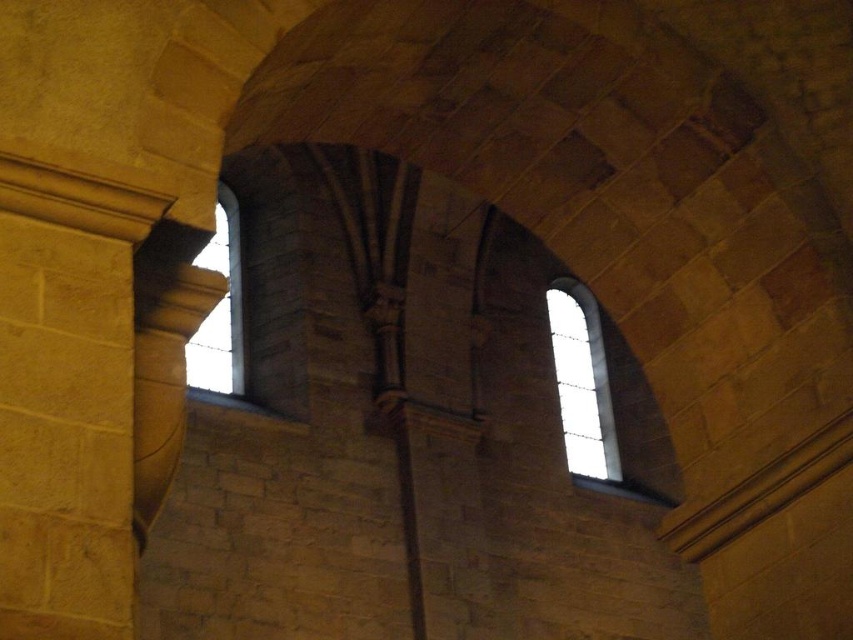
Question: Is clear glass window at upper right bigger than clear glass window at upper left?

Choices:
 (A) yes
 (B) no

Answer: (B)

Question: Is clear glass window at upper right to the left of clear glass window at upper left from the viewer's perspective?

Choices:
 (A) no
 (B) yes

Answer: (A)

Question: Does clear glass window at upper right lie in front of clear glass window at upper left?

Choices:
 (A) no
 (B) yes

Answer: (A)